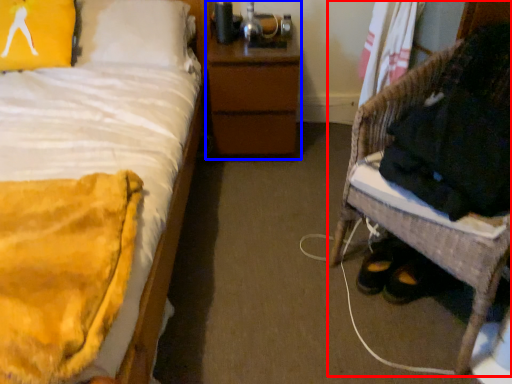
Question: Which object appears farthest to the camera in this image, furniture (highlighted by a red box) or nightstand (highlighted by a blue box)?

Choices:
 (A) furniture
 (B) nightstand

Answer: (B)